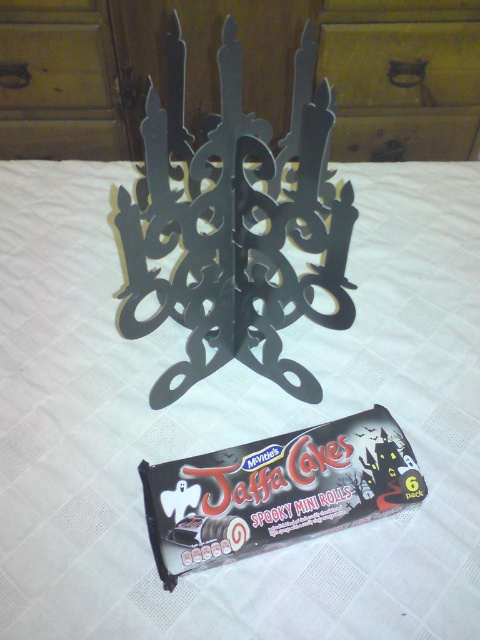
Which is more to the right, dark chocolate bar at center or brushed metal drawer at upper center?

brushed metal drawer at upper center

In the scene shown: Can you confirm if dark chocolate bar at center is positioned to the right of brushed metal drawer at upper center?

In fact, dark chocolate bar at center is to the left of brushed metal drawer at upper center.

Which is in front, point (324, 518) or point (451, 22)?

Point (324, 518) is more forward.

This screenshot has height=640, width=480. I want to click on dark chocolate bar at center, so click(x=276, y=492).

Between matte black candelabra at center and dark chocolate bar at center, which one appears on the left side from the viewer's perspective?

matte black candelabra at center is more to the left.

Is point (334, 154) closer to camera compared to point (266, 449)?

No, it is behind (266, 449).

What do you see at coordinates (242, 72) in the screenshot?
I see `matte black candelabra at center` at bounding box center [242, 72].

Identify the location of matte black candelabra at center. The width and height of the screenshot is (480, 640). (242, 72).

Is point (92, 140) more distant than point (405, 99)?

Yes.

Between matte black candelabra at center and brushed metal drawer at upper center, which one appears on the left side from the viewer's perspective?

From the viewer's perspective, matte black candelabra at center appears more on the left side.

Who is more forward, (452, 10) or (432, 76)?

Point (452, 10) is more forward.

At what (x,y) coordinates should I click in order to perform the action: click on matte black candelabra at center. Please return your answer as a coordinate pair (x, y). The height and width of the screenshot is (640, 480). Looking at the image, I should click on click(242, 72).